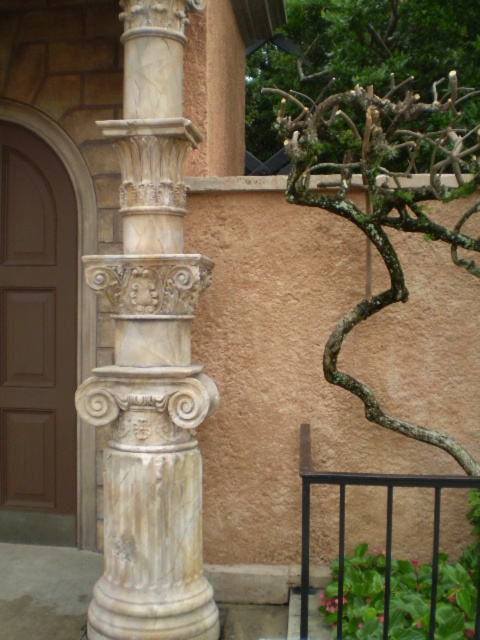
Who is positioned more to the left, white marble column at center or bare branches at upper right?

Positioned to the left is white marble column at center.

Describe the element at coordinates (151, 355) in the screenshot. I see `white marble column at center` at that location.

Image resolution: width=480 pixels, height=640 pixels. Identify the location of white marble column at center. (151, 355).